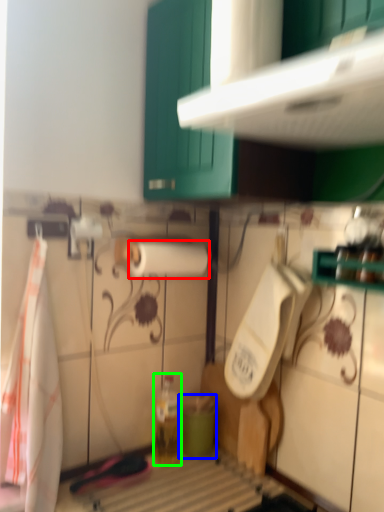
Question: Estimate the real-world distances between objects in this image. Which object is farther from paper towel (highlighted by a red box), teal (highlighted by a blue box) or bottle (highlighted by a green box)?

Choices:
 (A) teal
 (B) bottle

Answer: (A)